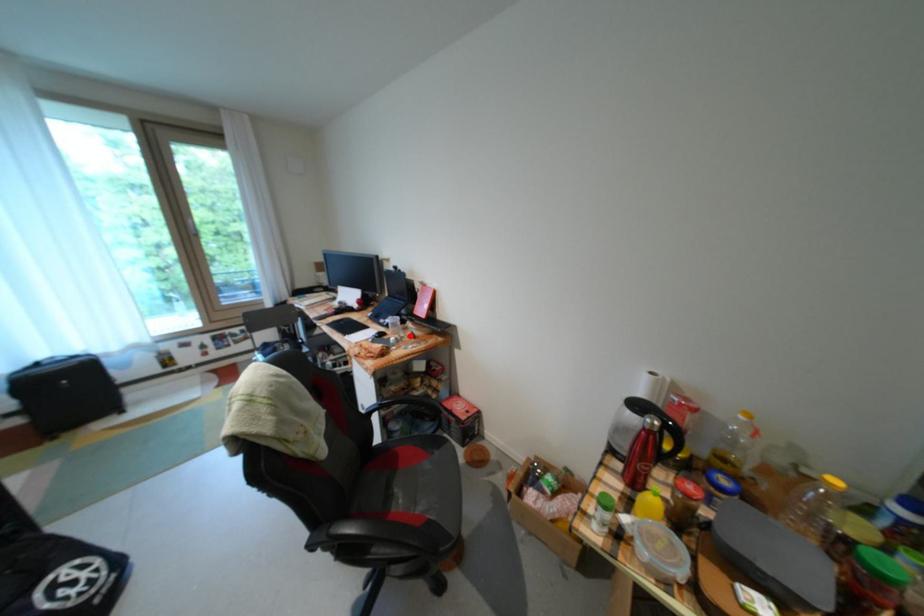
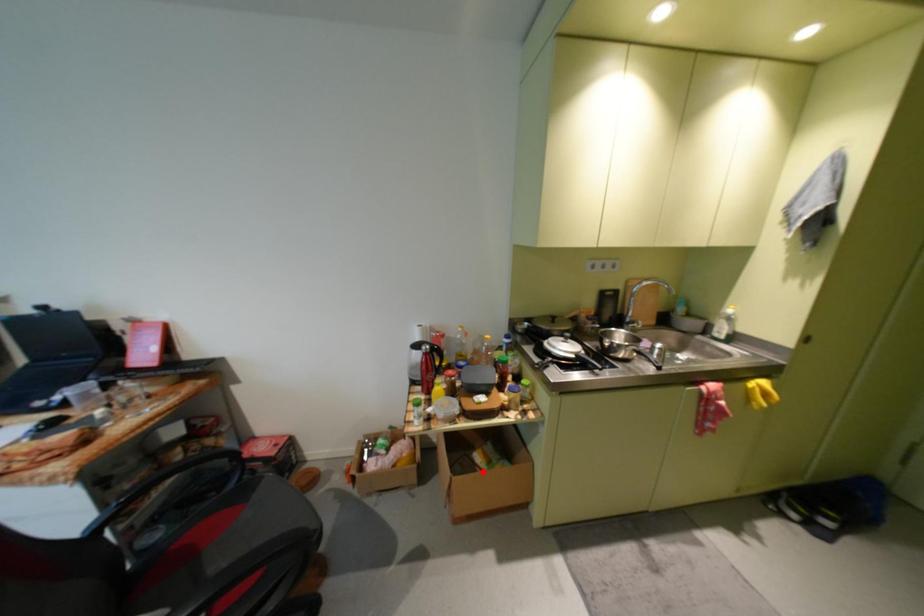
I am providing you with two images of the same scene from different viewpoints. A red point is marked on the first image and another point is marked on the second image. Is the marked point in image1 the same physical position as the marked point in image2?

No